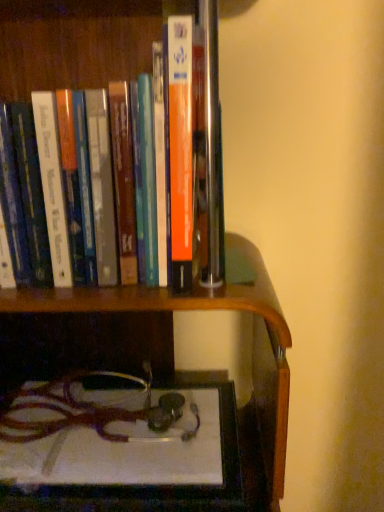
Question: Relative to orange matte book at upper center, is white glossy book at lower center in front or behind?

Choices:
 (A) behind
 (B) front

Answer: (A)

Question: Considering the relative positions of white glossy book at lower center and orange matte book at upper center in the image provided, is white glossy book at lower center to the left or to the right of orange matte book at upper center?

Choices:
 (A) left
 (B) right

Answer: (B)

Question: From their relative heights in the image, would you say white glossy book at lower center is taller or shorter than orange matte book at upper center?

Choices:
 (A) short
 (B) tall

Answer: (A)

Question: Is orange matte book at upper center taller or shorter than white glossy book at lower center?

Choices:
 (A) short
 (B) tall

Answer: (B)

Question: Would you say orange matte book at upper center is to the left or to the right of white glossy book at lower center in the picture?

Choices:
 (A) right
 (B) left

Answer: (B)

Question: Is orange matte book at upper center in front of or behind white glossy book at lower center in the image?

Choices:
 (A) behind
 (B) front

Answer: (B)

Question: Considering the positions of orange matte book at upper center and white glossy book at lower center in the image, is orange matte book at upper center wider or thinner than white glossy book at lower center?

Choices:
 (A) wide
 (B) thin

Answer: (B)